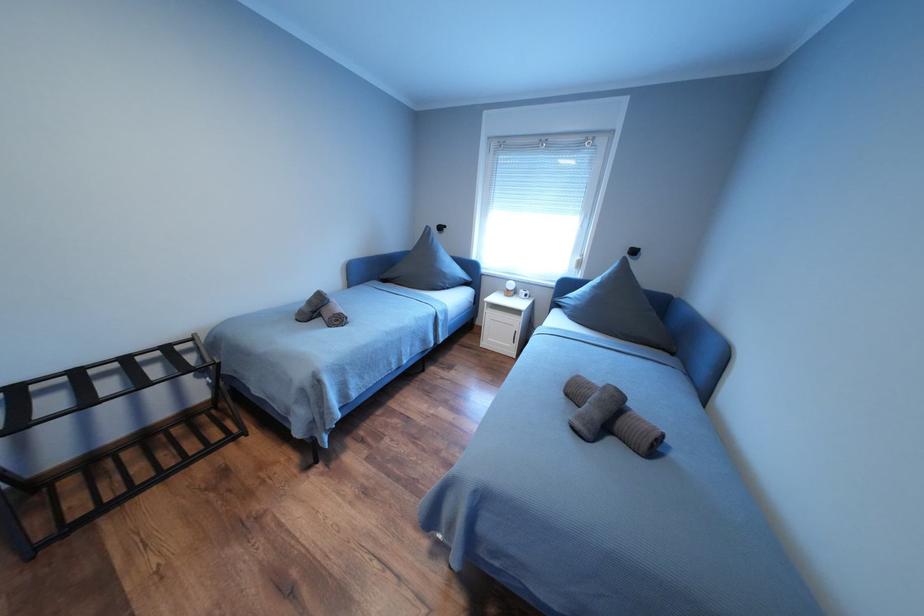
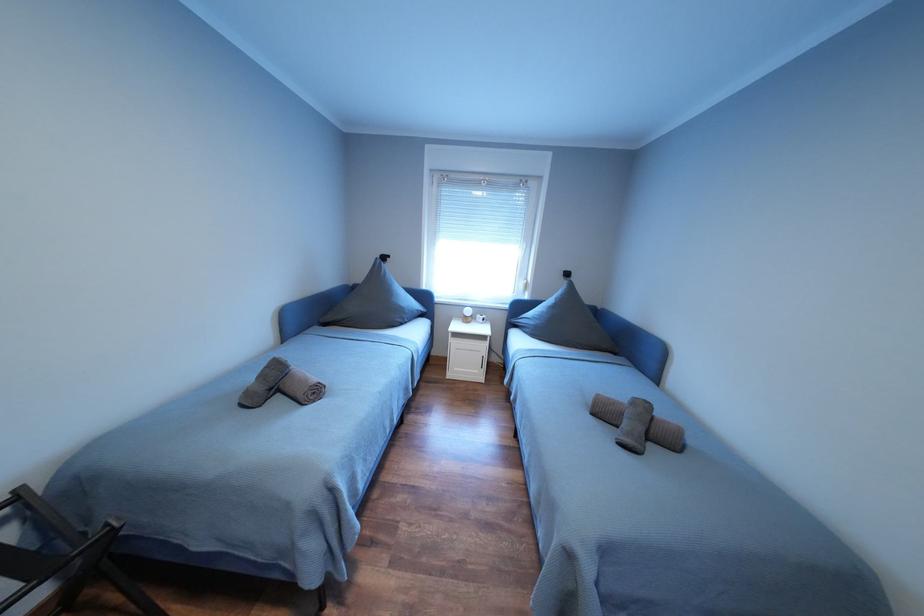
Question: The first image is from the beginning of the video and the second image is from the end. How did the camera likely rotate when shooting the video?

Choices:
 (A) Left
 (B) Right
 (C) Up
 (D) Down

Answer: (B)